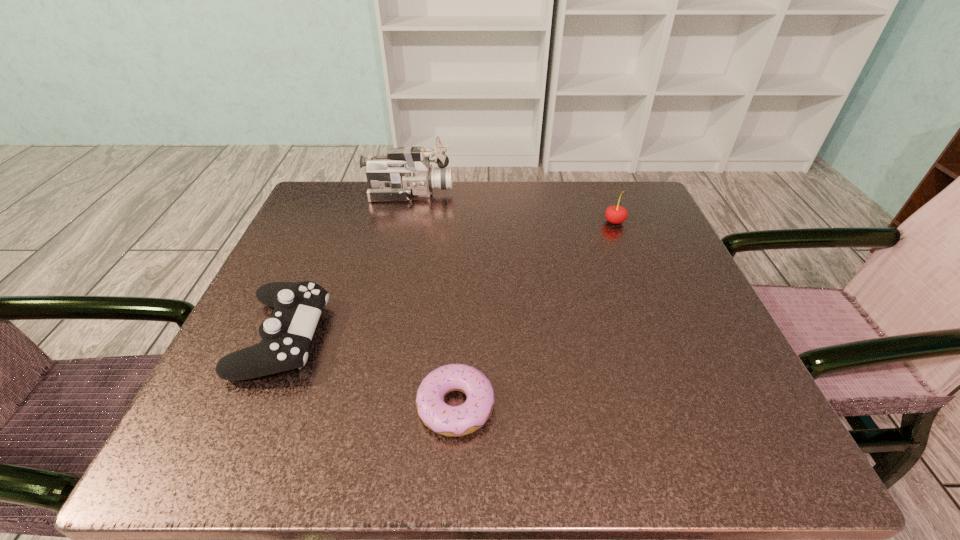
In the image, there is a desktop. Where is `vacant space at the right edge`? vacant space at the right edge is located at coordinates (654, 258).

The width and height of the screenshot is (960, 540). Identify the location of vacant area at the far left corner. (306, 227).

Find the location of a particular element. The height and width of the screenshot is (540, 960). free point at the near left corner is located at coordinates (262, 442).

At what (x,y) coordinates should I click in order to perform the action: click on vacant area at the far right corner. Please return your answer as a coordinate pair (x, y). The width and height of the screenshot is (960, 540). Looking at the image, I should click on (645, 193).

Locate an element on the screen. vacant space at the near right corner of the desktop is located at coordinates (666, 419).

Find the location of a particular element. vacant space in between the control and the tallest object is located at coordinates (347, 265).

The height and width of the screenshot is (540, 960). What are the coordinates of `vacant area that lies between the control and the farthest object` in the screenshot? It's located at (347, 265).

What are the coordinates of `empty space between the doughnut and the control` in the screenshot? It's located at (370, 371).

Locate an element on the screen. The height and width of the screenshot is (540, 960). free space between the third tallest object and the tallest object is located at coordinates (347, 265).

At what (x,y) coordinates should I click in order to perform the action: click on free area in between the doughnut and the control. Please return your answer as a coordinate pair (x, y). Looking at the image, I should click on (370, 371).